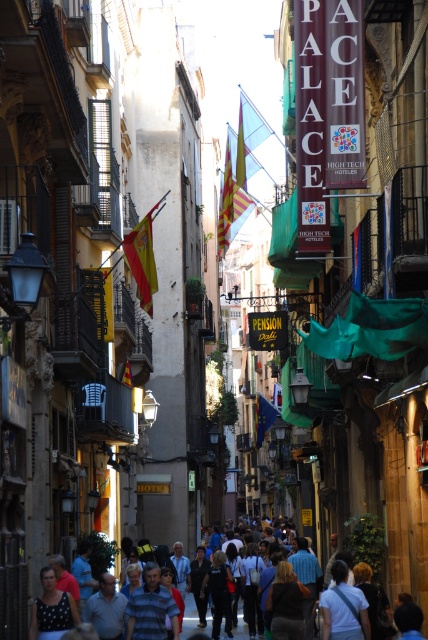
Can you confirm if yellow fabric flag at center is taller than light blue shirt at center?

Yes, yellow fabric flag at center is taller than light blue shirt at center.

Which is above, yellow fabric flag at center or light blue shirt at center?

yellow fabric flag at center is higher up.

Locate an element on the screen. This screenshot has width=428, height=640. yellow fabric flag at center is located at coordinates (231, 198).

The height and width of the screenshot is (640, 428). Identify the location of yellow fabric flag at center. (231, 198).

Does yellow fabric flag at center have a smaller size compared to matte fabric flag at center?

Actually, yellow fabric flag at center might be larger than matte fabric flag at center.

Consider the image. Who is positioned more to the right, yellow fabric flag at center or matte fabric flag at center?

yellow fabric flag at center is more to the right.

Is point (220, 244) closer to camera compared to point (127, 253)?

That is False.

Identify the location of yellow fabric flag at center. Image resolution: width=428 pixels, height=640 pixels. (231, 198).

In order to click on matte fabric flag at center in this screenshot , I will do `click(142, 259)`.

Between point (127, 252) and point (241, 627), which one is positioned in front?

Point (127, 252)

Does point (154, 272) come closer to viewer compared to point (243, 636)?

No.

The height and width of the screenshot is (640, 428). What are the coordinates of `matte fabric flag at center` in the screenshot? It's located at (142, 259).